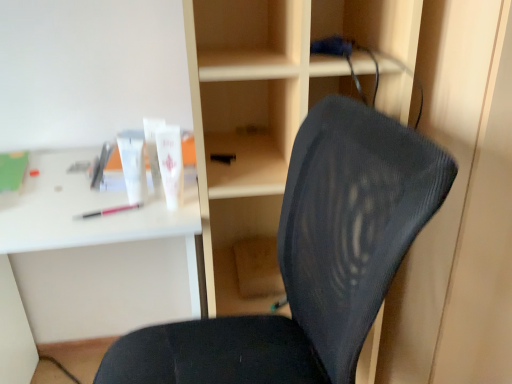
This screenshot has height=384, width=512. I want to click on free location to the right of pink plastic pen at left, so click(161, 209).